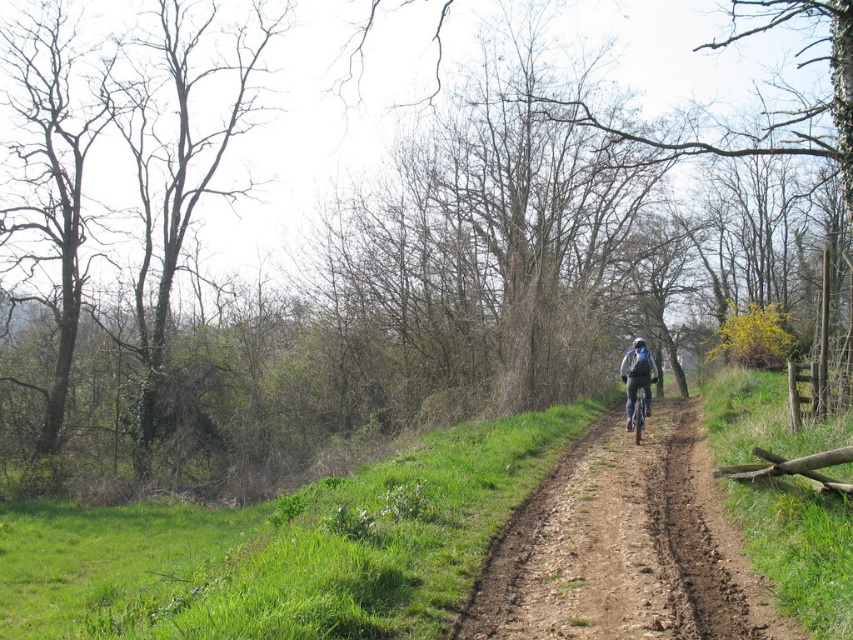
Does brown dirt track at center come in front of matte black bicycle at center?

Yes, brown dirt track at center is closer to the viewer.

Does brown dirt track at center appear under matte black bicycle at center?

Correct, brown dirt track at center is located below matte black bicycle at center.

Which is behind, point (601, 465) or point (641, 376)?

The point (641, 376) is behind.

Where is `brown dirt track at center`? Image resolution: width=853 pixels, height=640 pixels. brown dirt track at center is located at coordinates (624, 547).

Does matte black bicycle at center have a lesser width compared to shiny metallic bicycle at center-right?

Incorrect, matte black bicycle at center's width is not less than shiny metallic bicycle at center-right's.

Measure the distance between matte black bicycle at center and camera.

53.25 feet

Who is more forward, (628,404) or (634,380)?

Point (634,380) is more forward.

Locate an element on the screen. Image resolution: width=853 pixels, height=640 pixels. matte black bicycle at center is located at coordinates (637, 376).

In the scene shown: Can you confirm if brown dirt track at center is positioned below shiny metallic bicycle at center-right?

Yes.

Between brown dirt track at center and shiny metallic bicycle at center-right, which one is positioned lower?

brown dirt track at center is lower down.

What do you see at coordinates (624, 547) in the screenshot? I see `brown dirt track at center` at bounding box center [624, 547].

This screenshot has width=853, height=640. What are the coordinates of `brown dirt track at center` in the screenshot? It's located at (624, 547).